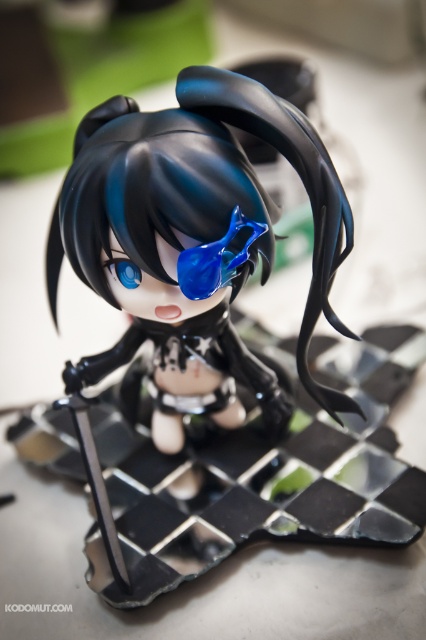
Which of these two, satin black hair at center or transparent blue goggles at center, stands taller?

With more height is satin black hair at center.

Does satin black hair at center have a lesser height compared to transparent blue goggles at center?

No.

Measure the distance between satin black hair at center and camera.

The distance of satin black hair at center from camera is 67.60 centimeters.

Where is `satin black hair at center`? Image resolution: width=426 pixels, height=640 pixels. satin black hair at center is located at coordinates (135, 189).